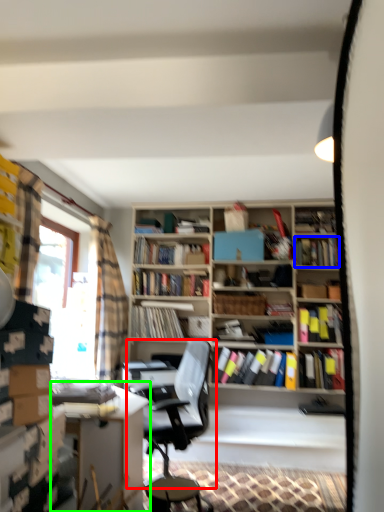
Question: Which object is the farthest from chair (highlighted by a red box)? Choose among these: book (highlighted by a blue box) or table (highlighted by a green box).

Choices:
 (A) book
 (B) table

Answer: (A)